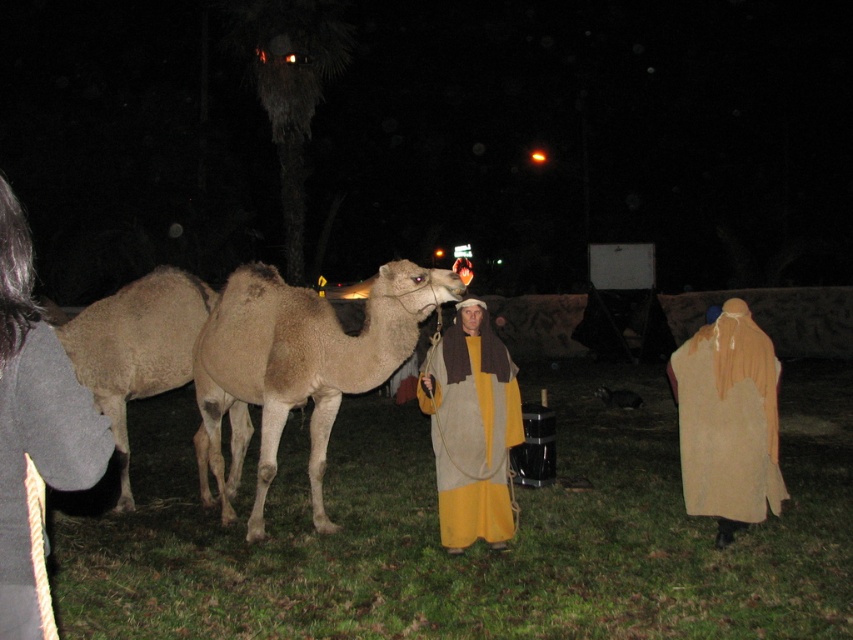
In the nighttime scene with two beige robes, one at the right and one at the lower left, which direction is the beige fabric robe at right relative to the beige cotton robe at lower left?

The beige fabric robe at right is located to the right of the beige cotton robe at lower left.

You are a photographer trying to capture the scene. You notice the light brown matte camel at center and the yellow woolen robe at center. Which object is positioned higher in the image?

The light brown matte camel at center is positioned higher than the yellow woolen robe at center in the image.

You are an observer in the nighttime scene. You notice two robes in the image. The yellow woolen robe at center and the beige cotton robe at lower left. Which robe would appear bigger to you?

The yellow woolen robe at center appears bigger than the beige cotton robe at lower left because it is larger in size.